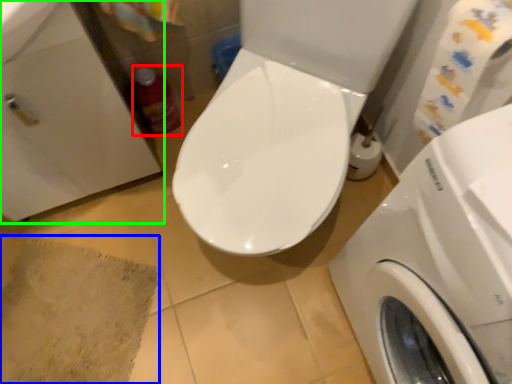
Question: Based on their relative distances, which object is nearer to cleaning product (highlighted by a red box)? Choose from bath mat (highlighted by a blue box) and sink (highlighted by a green box).

Choices:
 (A) bath mat
 (B) sink

Answer: (B)